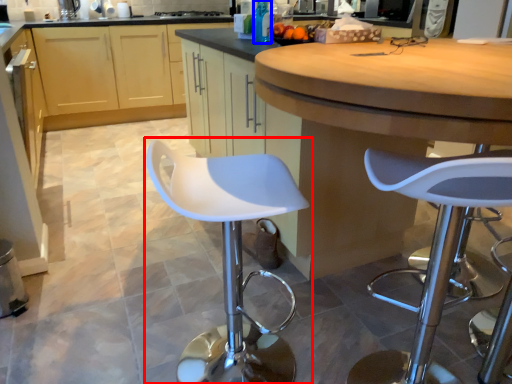
Question: Which of the following is the farthest to the observer, chair (highlighted by a red box) or bottle (highlighted by a blue box)?

Choices:
 (A) chair
 (B) bottle

Answer: (B)